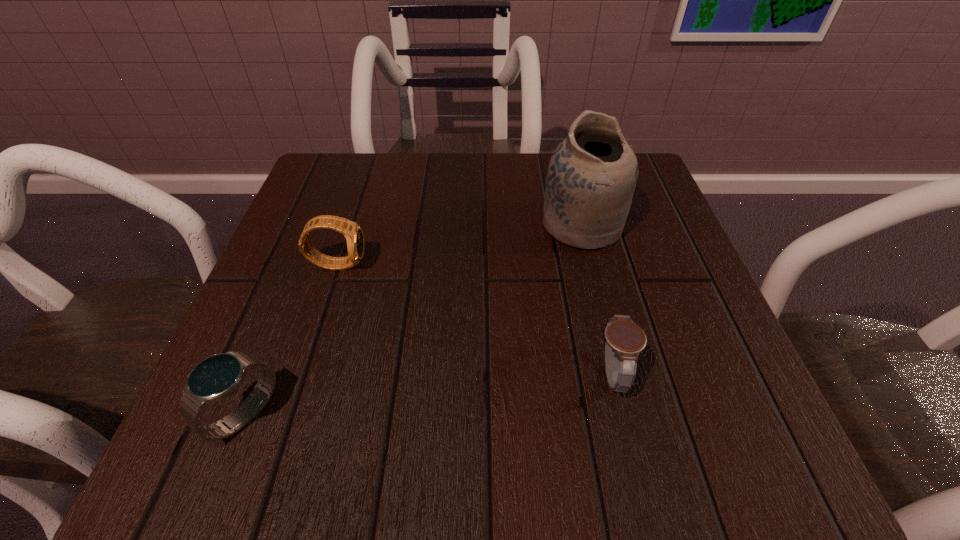
Locate an element on the screen. object situated at the near left corner is located at coordinates (217, 377).

Image resolution: width=960 pixels, height=540 pixels. I want to click on object present at the far right corner, so click(x=592, y=174).

Where is `vacant space at the far edge of the desktop`? vacant space at the far edge of the desktop is located at coordinates (424, 201).

In the image, there is a desktop. Identify the location of free space at the near edge. This screenshot has width=960, height=540. (527, 458).

The height and width of the screenshot is (540, 960). In the image, there is a desktop. Find the location of `vacant space at the left edge`. vacant space at the left edge is located at coordinates (326, 232).

The height and width of the screenshot is (540, 960). In the image, there is a desktop. In order to click on vacant space at the right edge in this screenshot , I will do `click(663, 356)`.

You are a GUI agent. You are given a task and a screenshot of the screen. Output one action in this format:
    pyautogui.click(x=<x>, y=<y>)
    Task: Click on the vacant region at the far left corner of the desktop
    
    Given the screenshot: What is the action you would take?
    pyautogui.click(x=388, y=164)

Find the location of `vacant space at the far right corner`. vacant space at the far right corner is located at coordinates (651, 213).

The height and width of the screenshot is (540, 960). Find the location of `free spot between the rightmost watch and the tallest object`. free spot between the rightmost watch and the tallest object is located at coordinates (596, 300).

Where is `free area in between the tallest object and the farthest watch`? The height and width of the screenshot is (540, 960). free area in between the tallest object and the farthest watch is located at coordinates (460, 244).